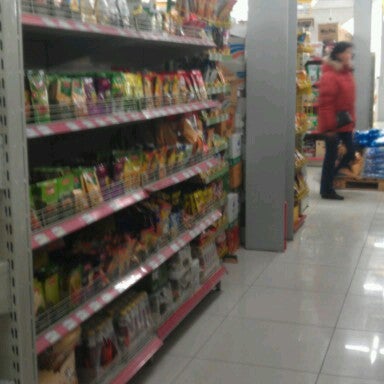
This screenshot has width=384, height=384. I want to click on shelves, so pyautogui.click(x=128, y=31), pyautogui.click(x=126, y=116), pyautogui.click(x=137, y=195), pyautogui.click(x=141, y=272), pyautogui.click(x=162, y=335).